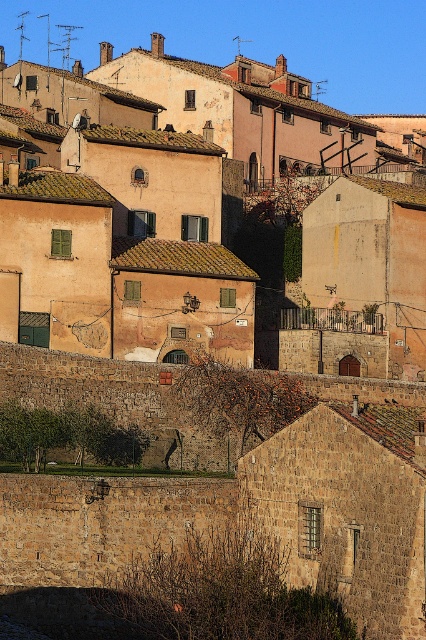
Can you confirm if rustic stone houses at center is positioned to the left of brown stone wall at lower left?

Indeed, rustic stone houses at center is positioned on the left side of brown stone wall at lower left.

Does point (316, 298) come in front of point (382, 428)?

No.

This screenshot has width=426, height=640. Identify the location of rustic stone houses at center. (222, 220).